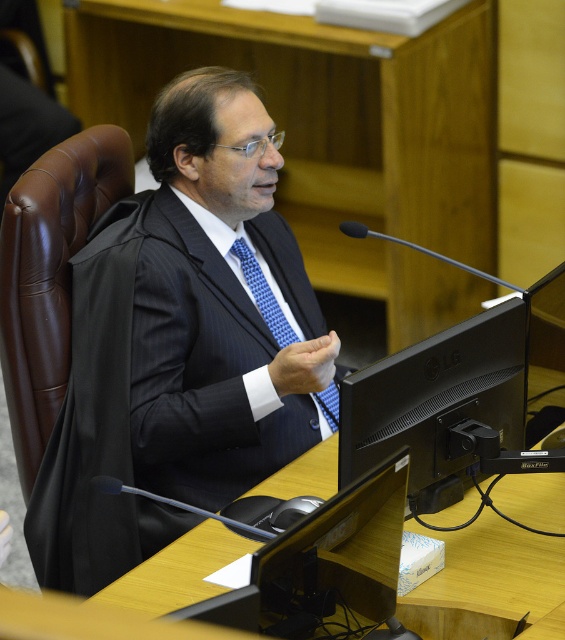
Based on the photo, is black glossy monitor at center positioned at the back of blue textured tie at center?

No, it is in front of blue textured tie at center.

Which is more to the right, black glossy monitor at center or blue textured tie at center?

Positioned to the right is black glossy monitor at center.

Between point (383, 424) and point (233, 243), which one is positioned in front?

Positioned in front is point (383, 424).

Where is `black glossy monitor at center`? The width and height of the screenshot is (565, 640). black glossy monitor at center is located at coordinates pyautogui.click(x=437, y=403).

Identify the location of dark blue suit at center. This screenshot has width=565, height=640. (180, 344).

Does point (271, 228) lie in front of point (414, 474)?

That is False.

You are a GUI agent. You are given a task and a screenshot of the screen. Output one action in this format:
    pyautogui.click(x=<x>, y=<y>)
    Task: Click on the dark blue suit at center
    The height and width of the screenshot is (640, 565).
    Given the screenshot: What is the action you would take?
    pyautogui.click(x=180, y=344)

Does point (519, 557) come farther from viewer compared to point (271, 316)?

No, (519, 557) is in front of (271, 316).

Can you confirm if wooden table at center is smaller than blue textured tie at center?

Incorrect, wooden table at center is not smaller in size than blue textured tie at center.

Which is behind, point (550, 625) or point (262, 307)?

The point (262, 307) is more distant.

The width and height of the screenshot is (565, 640). What are the coordinates of `wooden table at center` in the screenshot? It's located at (489, 582).